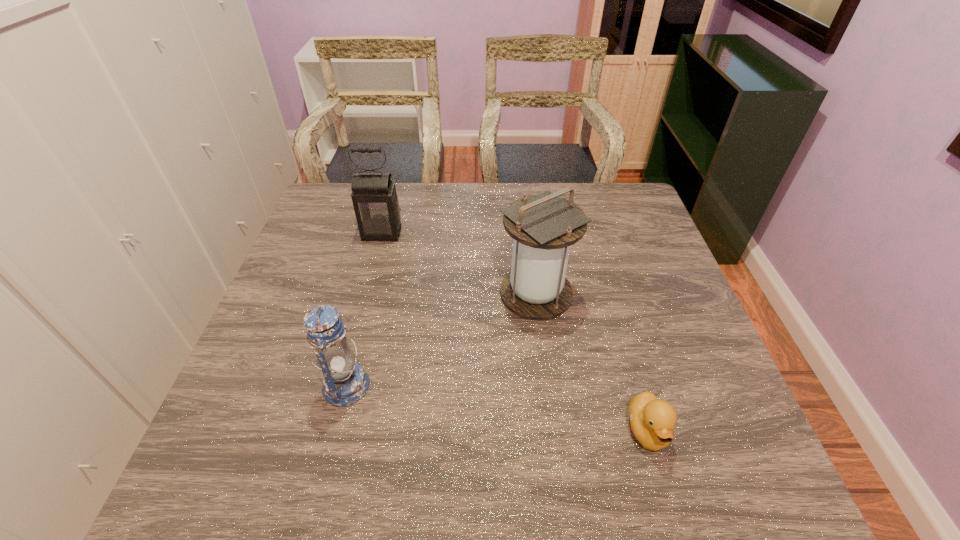
Locate an element on the screen. the second nearest lantern is located at coordinates (544, 226).

You are a GUI agent. You are given a task and a screenshot of the screen. Output one action in this format:
    pyautogui.click(x=<x>, y=<y>)
    Task: Click on the third object from left to right
    The width and height of the screenshot is (960, 540).
    Given the screenshot: What is the action you would take?
    pyautogui.click(x=544, y=226)

Identify the location of the farthest lantern. (375, 201).

Locate an element on the screen. This screenshot has height=540, width=960. the nearest lantern is located at coordinates (345, 382).

Locate an element on the screen. duckling is located at coordinates tap(652, 420).

Where is `the shortest object`? the shortest object is located at coordinates (652, 420).

Where is `free space located 0.080m on the right of the second farthest lantern`? free space located 0.080m on the right of the second farthest lantern is located at coordinates (606, 293).

Locate an element on the screen. vacant space located 0.050m on the front-facing side of the farthest object is located at coordinates (376, 254).

You are a GUI agent. You are given a task and a screenshot of the screen. Output one action in this format:
    pyautogui.click(x=<x>, y=<y>)
    Task: Click on the vacant space located 0.150m on the front-facing side of the nearest lantern
    This screenshot has height=540, width=960.
    Given the screenshot: What is the action you would take?
    pyautogui.click(x=440, y=386)

The image size is (960, 540). I want to click on object located at the far edge, so click(375, 201).